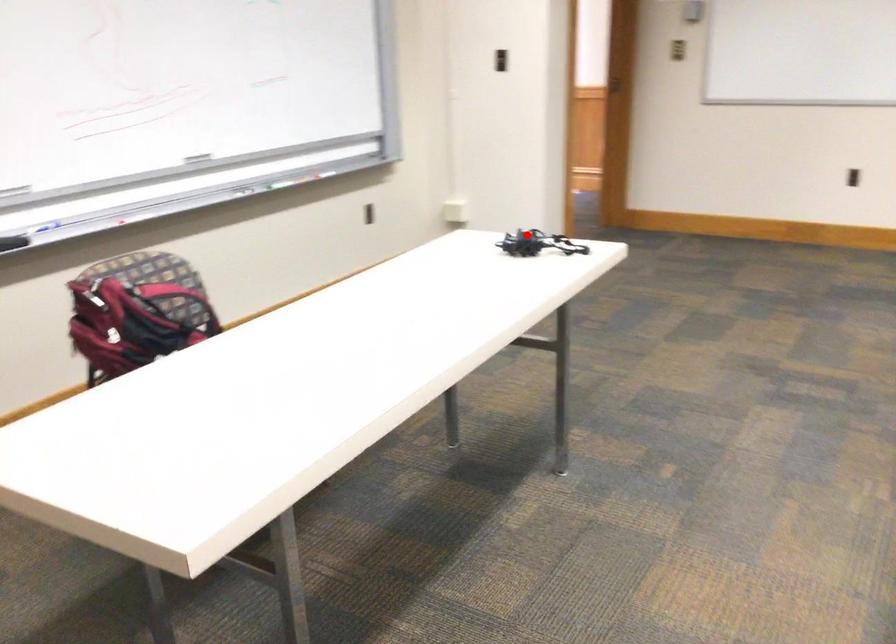
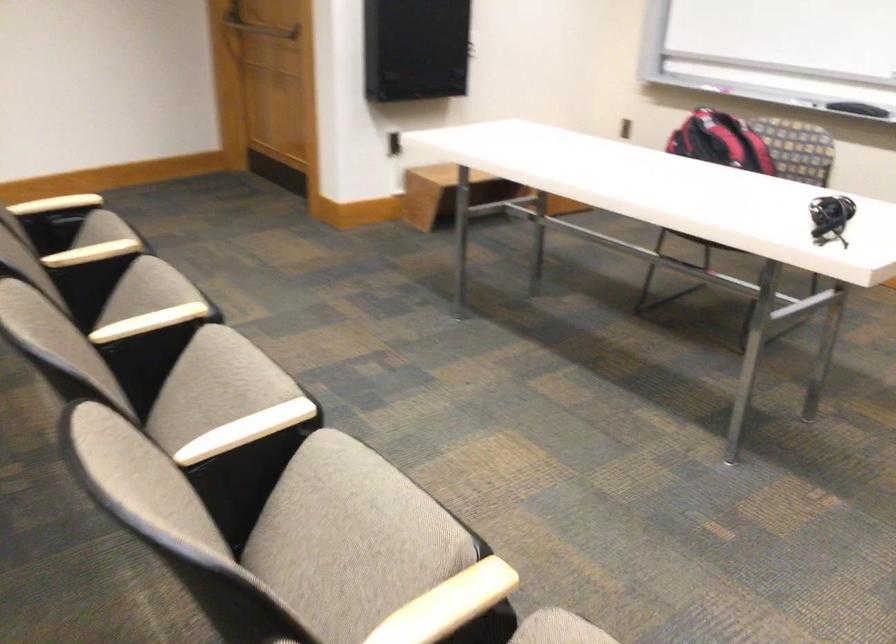
Question: I am providing you with two images of the same scene from different viewpoints. In image1, a red point is highlighted. Considering the same 3D point in image2, which of the following is correct?

Choices:
 (A) It is closer
 (B) It is farther

Answer: (A)